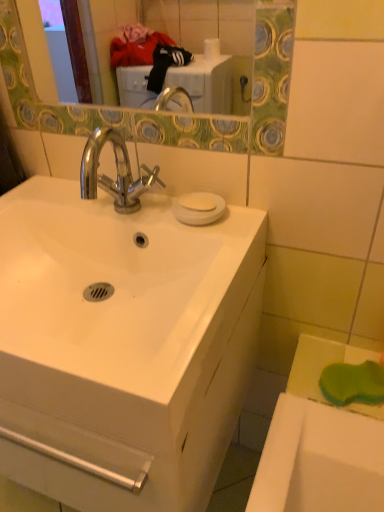
Question: Considering the positions of white matte soap at upper center and white glossy sink at center in the image, is white matte soap at upper center taller or shorter than white glossy sink at center?

Choices:
 (A) tall
 (B) short

Answer: (B)

Question: Is white matte soap at upper center wider or thinner than white glossy sink at center?

Choices:
 (A) thin
 (B) wide

Answer: (A)

Question: Which of these objects is positioned farthest from the white glossy cabinet at center?

Choices:
 (A) white matte soap at upper center
 (B) white glossy sink at center

Answer: (A)

Question: Estimate the real-world distances between objects in this image. Which object is closer to the white glossy cabinet at center?

Choices:
 (A) white matte soap at upper center
 (B) white glossy sink at center

Answer: (B)